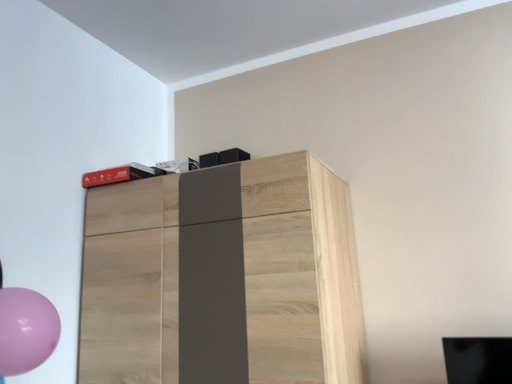
Locate an element on the screen. pink rubber balloon at lower left is located at coordinates (26, 330).

Measure the distance between point (9, 334) and camera.

The distance of point (9, 334) from camera is 37.80 inches.

The height and width of the screenshot is (384, 512). What do you see at coordinates (26, 330) in the screenshot?
I see `pink rubber balloon at lower left` at bounding box center [26, 330].

What are the coordinates of `pink rubber balloon at lower left` in the screenshot? It's located at (26, 330).